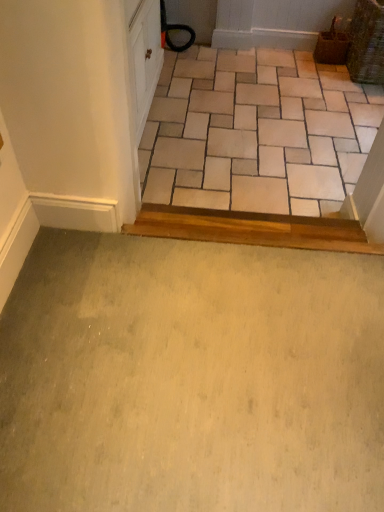
Find the location of a particular element. The image size is (384, 512). beige ceramic tile at upper center is located at coordinates (256, 132).

Describe the element at coordinates (256, 132) in the screenshot. I see `beige ceramic tile at upper center` at that location.

Consider the image. What is the approximate height of green carpet at lower center?

1.66 inches.

Image resolution: width=384 pixels, height=512 pixels. Describe the element at coordinates (191, 377) in the screenshot. I see `green carpet at lower center` at that location.

The image size is (384, 512). Find the location of `green carpet at lower center`. green carpet at lower center is located at coordinates (191, 377).

Where is `beige ceramic tile at upper center`? beige ceramic tile at upper center is located at coordinates (256, 132).

Considering the relative positions of beige ceramic tile at upper center and green carpet at lower center in the image provided, is beige ceramic tile at upper center to the left of green carpet at lower center from the viewer's perspective?

No, beige ceramic tile at upper center is not to the left of green carpet at lower center.

Which object is closer to the camera, beige ceramic tile at upper center or green carpet at lower center?

green carpet at lower center is more forward.

Does point (196, 164) lie behind point (188, 498)?

Yes.

From the image's perspective, is beige ceramic tile at upper center positioned above or below green carpet at lower center?

Based on their image positions, beige ceramic tile at upper center is located above green carpet at lower center.

In the scene shown: From a real-world perspective, which is physically below, beige ceramic tile at upper center or green carpet at lower center?

beige ceramic tile at upper center is physically lower.

Which object is wider, beige ceramic tile at upper center or green carpet at lower center?

Wider between the two is beige ceramic tile at upper center.

Considering the relative sizes of beige ceramic tile at upper center and green carpet at lower center in the image provided, is beige ceramic tile at upper center shorter than green carpet at lower center?

No, beige ceramic tile at upper center is not shorter than green carpet at lower center.

Does beige ceramic tile at upper center have a smaller size compared to green carpet at lower center?

Actually, beige ceramic tile at upper center might be larger than green carpet at lower center.

Is beige ceramic tile at upper center outside of green carpet at lower center?

Yes, beige ceramic tile at upper center is outside of green carpet at lower center.

Is beige ceramic tile at upper center not close to green carpet at lower center?

Yes, beige ceramic tile at upper center and green carpet at lower center are quite far apart.

Is beige ceramic tile at upper center facing away from green carpet at lower center?

beige ceramic tile at upper center is not turned away from green carpet at lower center.

What's the angular difference between beige ceramic tile at upper center and green carpet at lower center's facing directions?

0.109 degrees.

The height and width of the screenshot is (512, 384). I want to click on path in front of the beige ceramic tile at upper center, so (x=191, y=377).

Considering the positions of objects green carpet at lower center and beige ceramic tile at upper center in the image provided, who is more to the left, green carpet at lower center or beige ceramic tile at upper center?

green carpet at lower center is more to the left.

Is green carpet at lower center in front of beige ceramic tile at upper center?

Yes, it is in front of beige ceramic tile at upper center.

Which point is more forward, (140,383) or (273,116)?

Point (140,383)

From the image's perspective, between green carpet at lower center and beige ceramic tile at upper center, who is located below?

green carpet at lower center, from the image's perspective.

From a real-world perspective, which is physically above, green carpet at lower center or beige ceramic tile at upper center?

green carpet at lower center is physically above.

Considering the relative sizes of green carpet at lower center and beige ceramic tile at upper center in the image provided, is green carpet at lower center wider than beige ceramic tile at upper center?

No.

Does green carpet at lower center have a greater height compared to beige ceramic tile at upper center?

Incorrect, the height of green carpet at lower center is not larger of that of beige ceramic tile at upper center.

Considering the sizes of objects green carpet at lower center and beige ceramic tile at upper center in the image provided, who is bigger, green carpet at lower center or beige ceramic tile at upper center?

Bigger between the two is beige ceramic tile at upper center.

Is green carpet at lower center located outside beige ceramic tile at upper center?

green carpet at lower center is positioned outside beige ceramic tile at upper center.

Are green carpet at lower center and beige ceramic tile at upper center located far from each other?

Indeed, green carpet at lower center is not near beige ceramic tile at upper center.

Is green carpet at lower center oriented away from beige ceramic tile at upper center?

No.

How different are the orientations of green carpet at lower center and beige ceramic tile at upper center in degrees?

green carpet at lower center and beige ceramic tile at upper center are facing 0.109 degrees away from each other.

How much distance is there between green carpet at lower center and beige ceramic tile at upper center?

green carpet at lower center and beige ceramic tile at upper center are 4.45 feet apart from each other.

Find the location of `ceramic tile that is above the green carpet at lower center (from the image's perspective)`. ceramic tile that is above the green carpet at lower center (from the image's perspective) is located at coordinates (256, 132).

Where is `ceramic tile beneath the green carpet at lower center (from a real-world perspective)`? The image size is (384, 512). ceramic tile beneath the green carpet at lower center (from a real-world perspective) is located at coordinates (256, 132).

You are a GUI agent. You are given a task and a screenshot of the screen. Output one action in this format:
    pyautogui.click(x=<x>, y=<y>)
    Task: Click on the path above the beige ceramic tile at upper center (from a real-world perspective)
    The width and height of the screenshot is (384, 512).
    Given the screenshot: What is the action you would take?
    pyautogui.click(x=191, y=377)